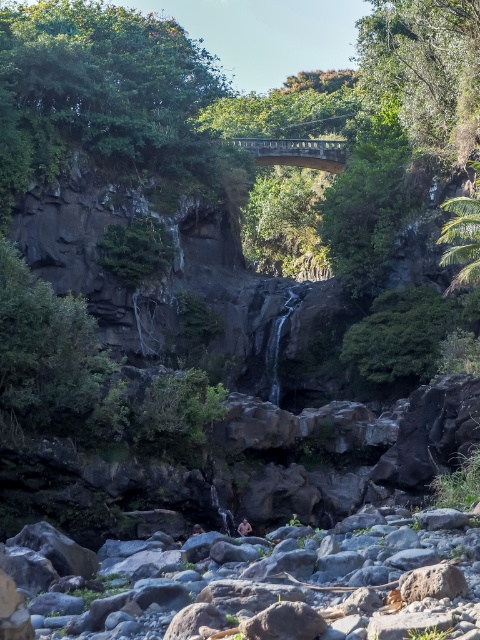
Does green leafy tree at upper left have a greater height compared to green leafy tree at upper center?

Indeed, green leafy tree at upper left has a greater height compared to green leafy tree at upper center.

Can you confirm if green leafy tree at upper left is positioned to the right of green leafy tree at upper center?

No, green leafy tree at upper left is not to the right of green leafy tree at upper center.

Who is more distant from viewer, (93, 1) or (475, 74)?

The point (93, 1) is behind.

Image resolution: width=480 pixels, height=640 pixels. In order to click on green leafy tree at upper left in this screenshot , I will do `click(107, 97)`.